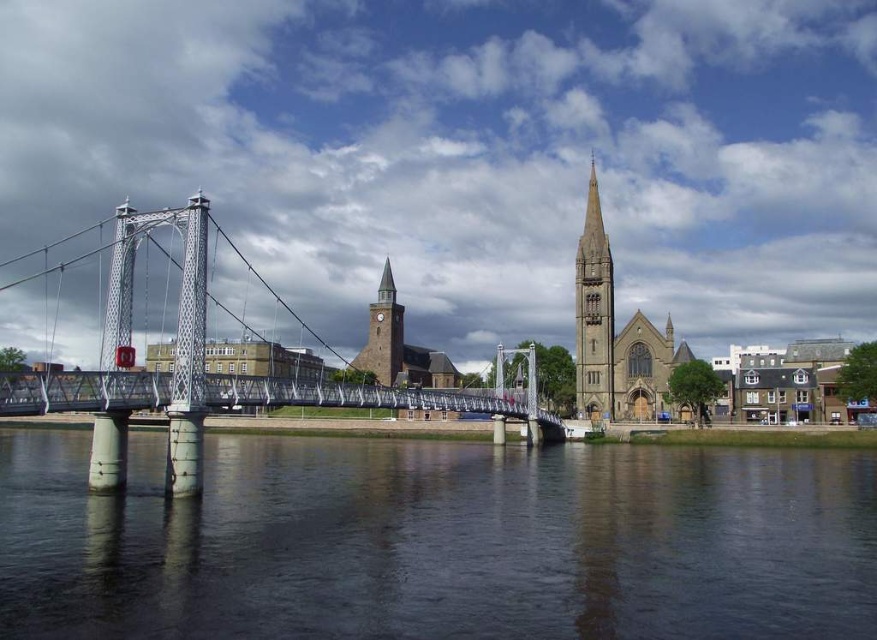
You are a drone operator tasked with flying a drone from the gray stone spire at center to the dark water at center. The drone has a maximum flight range of 150 feet. Can the drone safely complete this journey without needing to recharge?

The distance between the gray stone spire at center and the dark water at center is 145.00 feet, which is within the drone operator drone maximum flight range of 150 feet. The drone can safely complete the journey without needing to recharge.

You are a city planner reviewing the urban layout. You need to determine which of the two central landmarks, the gray stone spire at center or the brown stone clock tower at center, is the tallest. Based on the scene provided, which one is taller?

The gray stone spire at center is much taller than the brown stone clock tower at center, so the gray stone spire at center is the tallest.